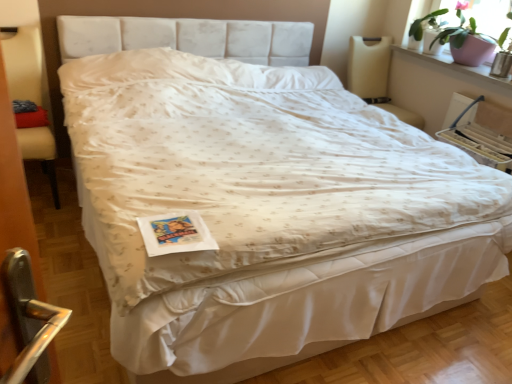
Describe the element at coordinates (24, 65) in the screenshot. I see `beige fabric armchair at left` at that location.

The image size is (512, 384). I want to click on pink ceramic pot at upper right, so click(x=456, y=66).

Locate an element on the screen. The width and height of the screenshot is (512, 384). beige fabric armchair at left is located at coordinates (24, 65).

Which object is further away from the camera, pink ceramic pot at upper right or pink ceramic pot at upper right?

pink ceramic pot at upper right is further away from the camera.

Is pink ceramic pot at upper right oriented towards pink ceramic pot at upper right?

No, pink ceramic pot at upper right is not oriented towards pink ceramic pot at upper right.

Is point (16, 57) behind point (444, 32)?

No.

Between beige fabric armchair at left and pink ceramic pot at upper right, which one has more height?

Standing taller between the two is beige fabric armchair at left.

Is beige fabric armchair at left facing towards pink ceramic pot at upper right?

No, beige fabric armchair at left is not aimed at pink ceramic pot at upper right.

Identify the location of houseplant that is above the beige fabric armchair at left (from a real-world perspective). The image size is (512, 384). (459, 35).

Is beige fabric armchair at left inside the boundaries of green matte plant at upper right, or outside?

beige fabric armchair at left is not inside green matte plant at upper right, it's outside.

Looking at this image, considering the relative sizes of beige fabric armchair at left and green matte plant at upper right in the image provided, is beige fabric armchair at left wider than green matte plant at upper right?

Indeed, beige fabric armchair at left has a greater width compared to green matte plant at upper right.

From a real-world perspective, does beige fabric armchair at left stand above green matte plant at upper right?

No.

From a real-world perspective, is pink ceramic pot at upper right physically located above or below green matte plant at upper right?

pink ceramic pot at upper right is situated lower than green matte plant at upper right in the real world.

At what (x,y) coordinates should I click in order to perform the action: click on houseplant located below the green matte plant at upper right (from the image's perspective). Please return your answer as a coordinate pair (x, y). The image size is (512, 384). Looking at the image, I should click on (459, 35).

Which of these two, pink ceramic pot at upper right or green matte plant at upper right, stands taller?

green matte plant at upper right is taller.

Between pink ceramic pot at upper right and green matte plant at upper right, which one appears on the right side from the viewer's perspective?

pink ceramic pot at upper right.

From the image's perspective, is pink ceramic pot at upper right above or below beige fabric armchair at left?

pink ceramic pot at upper right is above beige fabric armchair at left.

Does pink ceramic pot at upper right turn towards beige fabric armchair at left?

No, pink ceramic pot at upper right is not facing towards beige fabric armchair at left.

Which object is closer to the camera taking this photo, pink ceramic pot at upper right or beige fabric armchair at left?

beige fabric armchair at left is closer to the camera.

Who is smaller, pink ceramic pot at upper right or green matte plant at upper right?

With smaller size is pink ceramic pot at upper right.

How many degrees apart are the facing directions of pink ceramic pot at upper right and green matte plant at upper right?

The facing directions of pink ceramic pot at upper right and green matte plant at upper right are 1.82 degrees apart.

Between pink ceramic pot at upper right and green matte plant at upper right, which one is positioned behind?

green matte plant at upper right is further away from the camera.

Which point is more forward, (464, 70) or (475, 26)?

Positioned in front is point (464, 70).

From the image's perspective, which object appears higher, beige fabric armchair at left or pink ceramic pot at upper right?

pink ceramic pot at upper right appears higher in the image.

From a real-world perspective, relative to pink ceramic pot at upper right, is beige fabric armchair at left vertically above or below?

From a real-world perspective, beige fabric armchair at left is physically below pink ceramic pot at upper right.

The width and height of the screenshot is (512, 384). Identify the location of armchair in front of the pink ceramic pot at upper right. (24, 65).

Does point (31, 76) lie in front of point (442, 65)?

That is True.

This screenshot has width=512, height=384. In order to click on window sill below the pink ceramic pot at upper right (from a real-world perspective) in this screenshot , I will do `click(456, 66)`.

In the image, there is a beige fabric armchair at left. Identify the location of houseplant above it (from the image's perspective). point(459,35).

Looking at the image, which one is located closer to pink ceramic pot at upper right, pink ceramic pot at upper right or beige fabric armchair at left?

Among the two, pink ceramic pot at upper right is located nearer to pink ceramic pot at upper right.

Based on their spatial positions, is beige fabric armchair at left or pink ceramic pot at upper right further from pink ceramic pot at upper right?

beige fabric armchair at left is further to pink ceramic pot at upper right.

From the image, which object appears to be nearer to beige fabric armchair at left, pink ceramic pot at upper right or green matte plant at upper right?

The object closer to beige fabric armchair at left is pink ceramic pot at upper right.

Considering their positions, is pink ceramic pot at upper right positioned closer to beige fabric armchair at left than pink ceramic pot at upper right?

The object closer to beige fabric armchair at left is pink ceramic pot at upper right.

Which object lies further to the anchor point pink ceramic pot at upper right, green matte plant at upper right or pink ceramic pot at upper right?

pink ceramic pot at upper right is positioned further to the anchor pink ceramic pot at upper right.

Considering their positions, is pink ceramic pot at upper right positioned further to beige fabric armchair at left than pink ceramic pot at upper right?

pink ceramic pot at upper right is further to beige fabric armchair at left.

Looking at the image, which one is located closer to pink ceramic pot at upper right, pink ceramic pot at upper right or green matte plant at upper right?

green matte plant at upper right is positioned closer to the anchor pink ceramic pot at upper right.

Looking at the image, which one is located closer to green matte plant at upper right, pink ceramic pot at upper right or beige fabric armchair at left?

Among the two, pink ceramic pot at upper right is located nearer to green matte plant at upper right.

I want to click on plant between beige fabric armchair at left and pink ceramic pot at upper right in the horizontal direction, so click(x=457, y=30).

Locate an element on the screen. houseplant between pink ceramic pot at upper right and green matte plant at upper right along the z-axis is located at coordinates (459, 35).

Locate an element on the screen. This screenshot has width=512, height=384. houseplant between beige fabric armchair at left and pink ceramic pot at upper right in the horizontal direction is located at coordinates (459, 35).

This screenshot has height=384, width=512. In order to click on plant located between beige fabric armchair at left and pink ceramic pot at upper right in the left-right direction in this screenshot , I will do pyautogui.click(x=457, y=30).